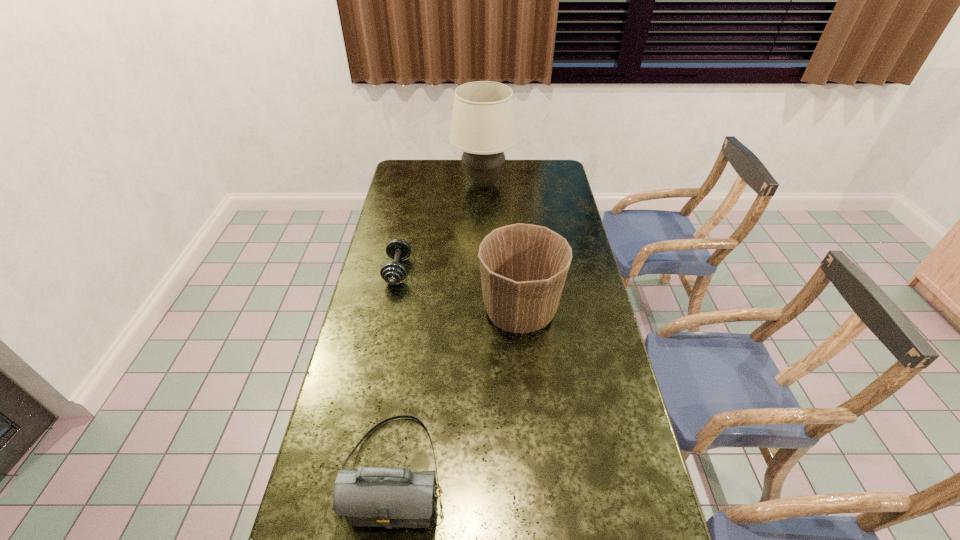
At what (x,y) coordinates should I click in order to perform the action: click on free spot between the shortest object and the flowerpot. Please return your answer as a coordinate pair (x, y). Looking at the image, I should click on (459, 291).

Where is `unoccupied area between the lampshade and the nearest object`? The image size is (960, 540). unoccupied area between the lampshade and the nearest object is located at coordinates (439, 328).

Where is `vacant space that's between the lampshade and the shoulder bag`? vacant space that's between the lampshade and the shoulder bag is located at coordinates (439, 328).

Where is `free spot between the shoulder bag and the shortest object`? free spot between the shoulder bag and the shortest object is located at coordinates (396, 371).

Identify the location of vacant space in between the dumbbell and the flowerpot. pos(459,291).

What are the coordinates of `free spot between the shortest object and the nearest object` in the screenshot? It's located at (396, 371).

Where is `unoccupied area between the dumbbell and the tallest object`? The image size is (960, 540). unoccupied area between the dumbbell and the tallest object is located at coordinates (441, 227).

Identify the location of blank region between the dumbbell and the lampshade. (441, 227).

Locate an element on the screen. object that ranks as the third closest to the third shortest object is located at coordinates (483, 125).

Where is `object that is the closest to the second shortest object`? The height and width of the screenshot is (540, 960). object that is the closest to the second shortest object is located at coordinates (523, 267).